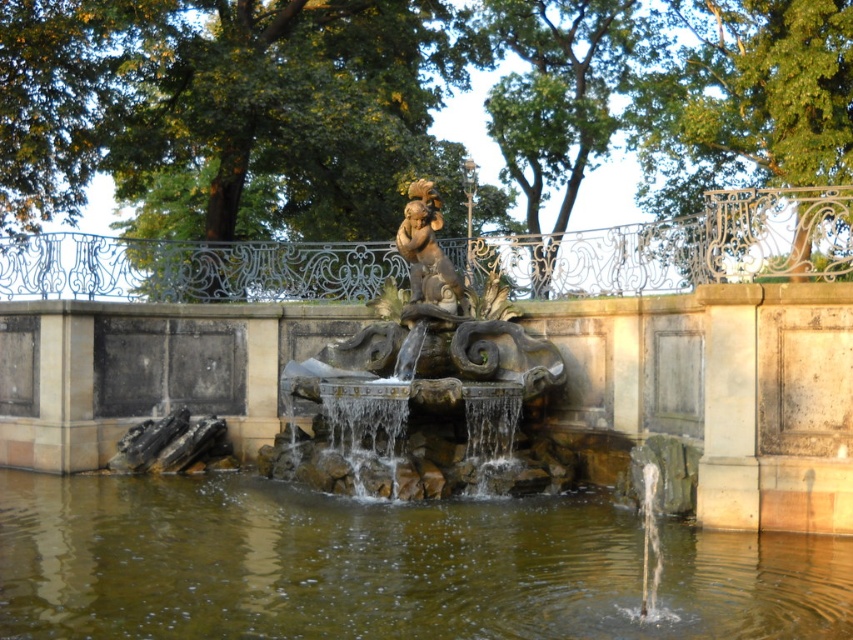
Question: Does brown stone water at center appear on the right side of gold polished statue at center?

Choices:
 (A) no
 (B) yes

Answer: (A)

Question: Which of the following is the farthest from the observer?

Choices:
 (A) stone fountain at center
 (B) gold polished statue at center
 (C) brown stone water at center

Answer: (B)

Question: Is brown stone water at center above gold polished statue at center?

Choices:
 (A) no
 (B) yes

Answer: (A)

Question: Which of these objects is positioned closest to the gold polished statue at center?

Choices:
 (A) stone fountain at center
 (B) brown stone water at center

Answer: (A)

Question: Which point is farther to the camera?

Choices:
 (A) gold polished statue at center
 (B) stone fountain at center
 (C) brown stone water at center

Answer: (A)

Question: Is brown stone water at center thinner than gold polished statue at center?

Choices:
 (A) no
 (B) yes

Answer: (A)